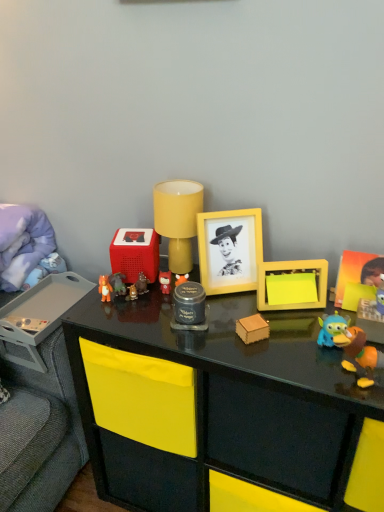
At what (x,y) coordinates should I click in order to perform the action: click on free point in front of wooden block at center, which is counted as the fourth toy, starting from the right. Please return your answer as a coordinate pair (x, y). The image size is (384, 512). Looking at the image, I should click on [274, 370].